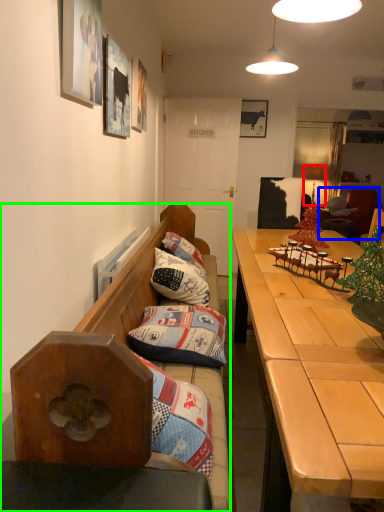
Question: Based on their relative distances, which object is nearer to lamp (highlighted by a red box)? Choose from bean bag chair (highlighted by a blue box) and studio couch (highlighted by a green box).

Choices:
 (A) bean bag chair
 (B) studio couch

Answer: (A)